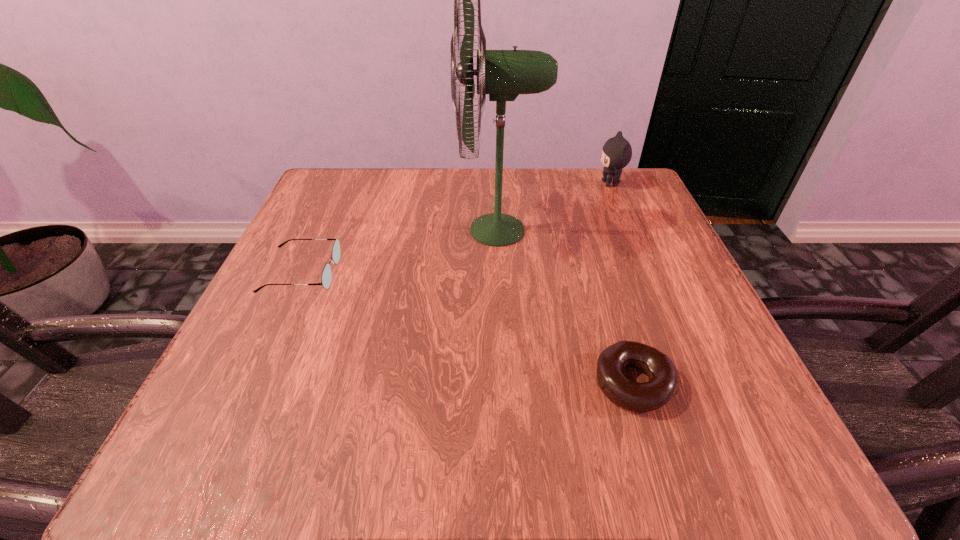
What are the coordinates of `vacant region that satisfies the following two spatial constraints: 1. on the front-facing side of the tallest object; 2. on the left side of the second object from right to left` in the screenshot? It's located at (507, 383).

Where is `vacant area that satisfies the following two spatial constraints: 1. on the front-facing side of the second object from left to right; 2. on the right side of the doughnut`? vacant area that satisfies the following two spatial constraints: 1. on the front-facing side of the second object from left to right; 2. on the right side of the doughnut is located at coordinates point(507,383).

Identify the location of free space that satisfies the following two spatial constraints: 1. on the back side of the doughnut; 2. on the lenses of the spectacles. This screenshot has height=540, width=960. (599, 273).

Where is `vacant space that satisfies the following two spatial constraints: 1. on the lenses of the spectacles; 2. on the back side of the doughnut`? vacant space that satisfies the following two spatial constraints: 1. on the lenses of the spectacles; 2. on the back side of the doughnut is located at coordinates (252, 383).

Where is `vacant space that satisfies the following two spatial constraints: 1. on the front-facing side of the rightmost object; 2. on the front side of the third object from left to right`? The width and height of the screenshot is (960, 540). vacant space that satisfies the following two spatial constraints: 1. on the front-facing side of the rightmost object; 2. on the front side of the third object from left to right is located at coordinates 695,383.